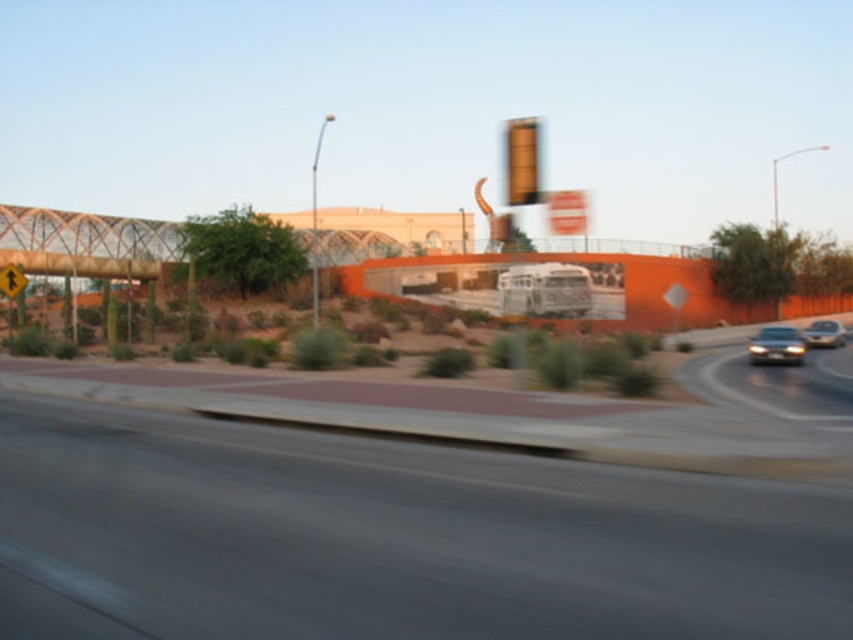
Question: Is shiny silver sedan at right behind silver metallic sedan at right?

Choices:
 (A) yes
 (B) no

Answer: (B)

Question: Which is farther from the metallic glass overpass at center?

Choices:
 (A) silver metallic sedan at right
 (B) gray asphalt highway at center
 (C) shiny silver sedan at right

Answer: (B)

Question: Which object is farther from the camera taking this photo?

Choices:
 (A) shiny silver sedan at right
 (B) yellow reflective pedestrian at left

Answer: (B)

Question: Which object appears closest to the camera in this image?

Choices:
 (A) yellow reflective pedestrian at left
 (B) metallic glass overpass at center
 (C) gray asphalt highway at center

Answer: (C)

Question: Can you confirm if matte orange traffic light at upper center is bigger than yellow reflective pedestrian at left?

Choices:
 (A) no
 (B) yes

Answer: (B)

Question: Is matte orange traffic light at upper center further to the viewer compared to shiny silver sedan at right?

Choices:
 (A) no
 (B) yes

Answer: (A)